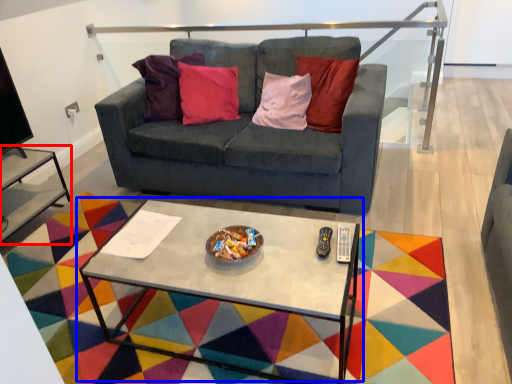
Question: Which object appears farthest to the camera in this image, side table (highlighted by a red box) or coffee table (highlighted by a blue box)?

Choices:
 (A) side table
 (B) coffee table

Answer: (A)